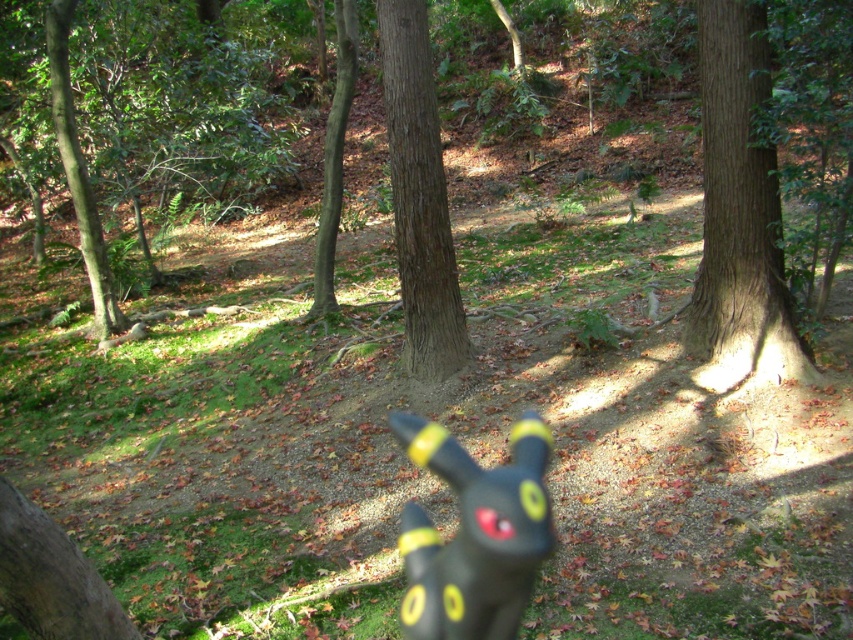
Can you confirm if brown rough tree at center is shorter than brown rough tree at left?

Correct, brown rough tree at center is not as tall as brown rough tree at left.

Does brown rough tree at center appear on the left side of brown rough tree at left?

Incorrect, brown rough tree at center is not on the left side of brown rough tree at left.

What do you see at coordinates (419, 196) in the screenshot?
I see `brown rough tree at center` at bounding box center [419, 196].

Where is `brown rough tree at center`? The image size is (853, 640). brown rough tree at center is located at coordinates (419, 196).

Is brown rough bark tree at right closer to camera compared to brown rough tree trunk at center?

That is True.

Which is in front, point (770, 221) or point (352, 16)?

Point (770, 221) is in front.

Where is `brown rough bark tree at right`? Image resolution: width=853 pixels, height=640 pixels. brown rough bark tree at right is located at coordinates (740, 212).

You are a GUI agent. You are given a task and a screenshot of the screen. Output one action in this format:
    pyautogui.click(x=<x>, y=<y>)
    Task: Click on the brown rough bark tree at right
    Image resolution: width=853 pixels, height=640 pixels.
    Given the screenshot: What is the action you would take?
    pyautogui.click(x=740, y=212)

Does brown rough bark tree at right have a lesser height compared to brown rough tree at left?

Indeed, brown rough bark tree at right has a lesser height compared to brown rough tree at left.

How distant is brown rough bark tree at right from brown rough tree at left?

They are 6.15 meters apart.

Describe the element at coordinates (740, 212) in the screenshot. The width and height of the screenshot is (853, 640). I see `brown rough bark tree at right` at that location.

Image resolution: width=853 pixels, height=640 pixels. In order to click on brown rough bark tree at right in this screenshot , I will do `click(740, 212)`.